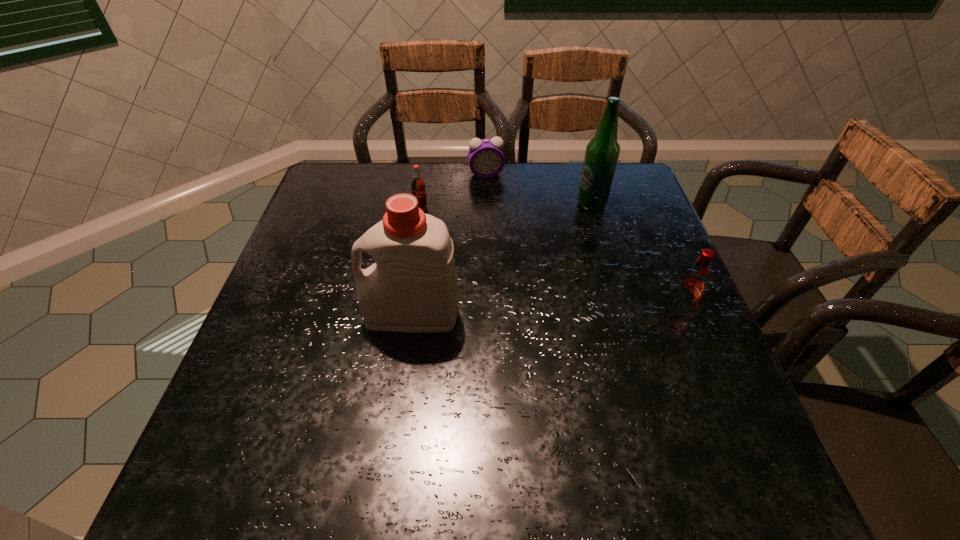
At what (x,y) coordinates should I click in order to perform the action: click on vacant region between the shortest object and the second object from right to left. Please return your answer as a coordinate pair (x, y). Looking at the image, I should click on (539, 189).

At what (x,y) coordinates should I click in order to perform the action: click on free spot between the soda bottle and the beer bottle. Please return your answer as a coordinate pair (x, y). The image size is (960, 540). Looking at the image, I should click on (507, 210).

Where is `unoccupied area between the third object from right to left and the soda bottle`? This screenshot has height=540, width=960. unoccupied area between the third object from right to left and the soda bottle is located at coordinates (454, 195).

The width and height of the screenshot is (960, 540). I want to click on free spot between the rightmost object and the second object from right to left, so click(x=636, y=258).

Image resolution: width=960 pixels, height=540 pixels. I want to click on free space between the root beer and the third object from right to left, so click(583, 244).

The image size is (960, 540). I want to click on vacant area between the rightmost object and the fourth tallest object, so click(x=550, y=265).

What are the coordinates of `vacant space that is in between the beer bottle and the farthest object` in the screenshot? It's located at (539, 189).

Identify which object is the fourth nearest to the alarm clock. Please provide its 2D coordinates. Your answer should be formatted as a tuple, i.e. [(x, y)], where the tuple contains the x and y coordinates of a point satisfying the conditions above.

[(693, 284)]

Locate an element on the screen. The width and height of the screenshot is (960, 540). object that stands as the third closest to the fourth object from left to right is located at coordinates (418, 188).

The width and height of the screenshot is (960, 540). Find the location of `free region that satisfies the following two spatial constraints: 1. on the front side of the root beer; 2. on the right side of the third object from right to left`. free region that satisfies the following two spatial constraints: 1. on the front side of the root beer; 2. on the right side of the third object from right to left is located at coordinates (489, 313).